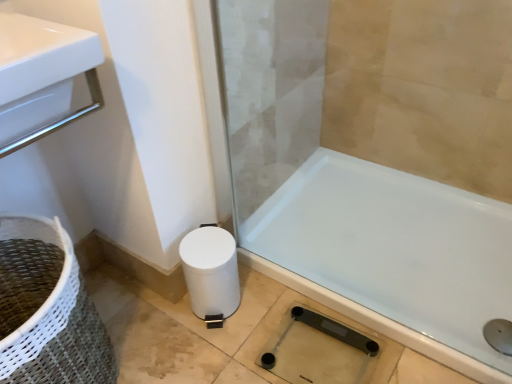
You are a GUI agent. You are given a task and a screenshot of the screen. Output one action in this format:
    pyautogui.click(x=<x>, y=<y>)
    Task: Click on the vacant space to the right of white matte toilet paper at lower left
    Image resolution: width=512 pixels, height=384 pixels.
    Given the screenshot: What is the action you would take?
    pyautogui.click(x=257, y=303)